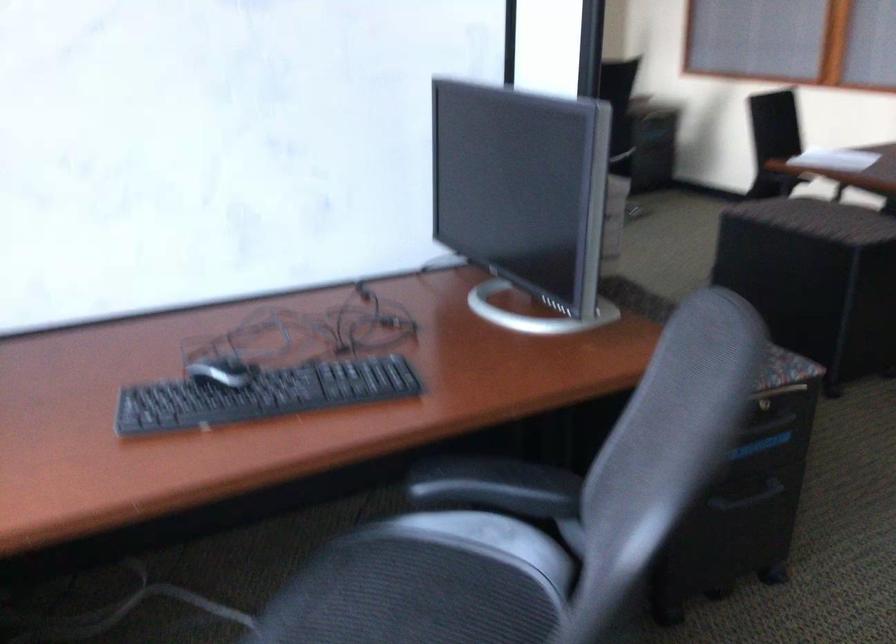
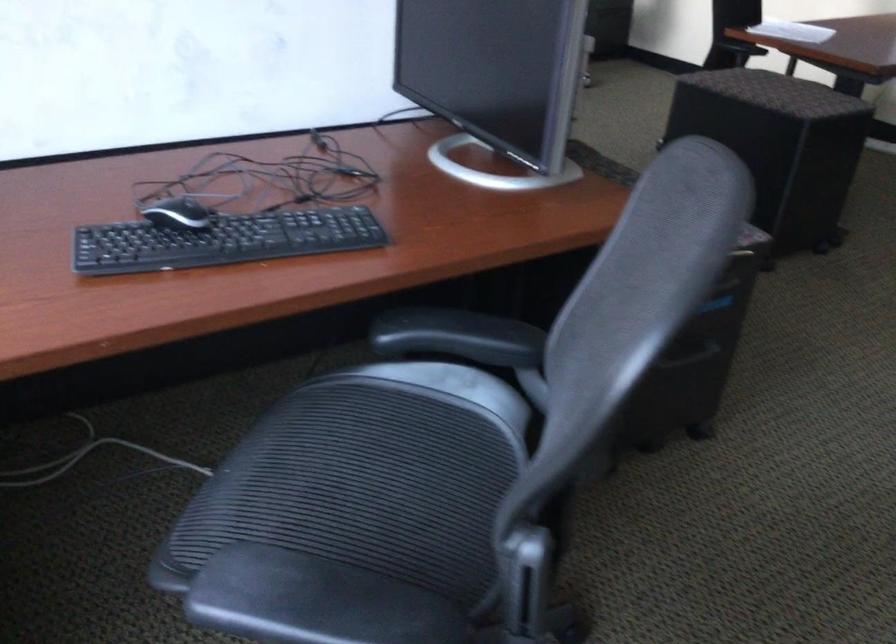
Where in the second image is the point corresponding to point 260,397 from the first image?

(222, 240)